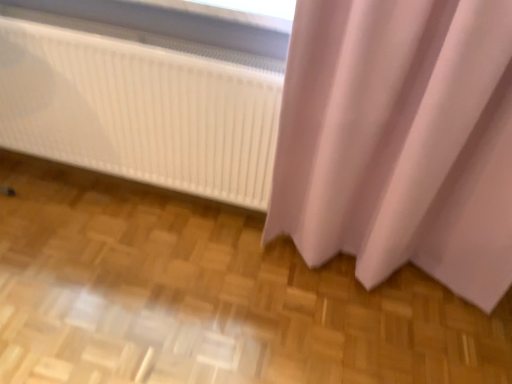
This screenshot has width=512, height=384. What do you see at coordinates (139, 111) in the screenshot?
I see `white glossy radiator at upper center` at bounding box center [139, 111].

What is the approximate width of white glossy radiator at upper center?

5.88 inches.

You are a GUI agent. You are given a task and a screenshot of the screen. Output one action in this format:
    pyautogui.click(x=<x>, y=<y>)
    Task: Click on the white glossy radiator at upper center
    Image resolution: width=512 pixels, height=384 pixels.
    Given the screenshot: What is the action you would take?
    pyautogui.click(x=139, y=111)

Where is `white glossy radiator at upper center`? This screenshot has height=384, width=512. white glossy radiator at upper center is located at coordinates (139, 111).